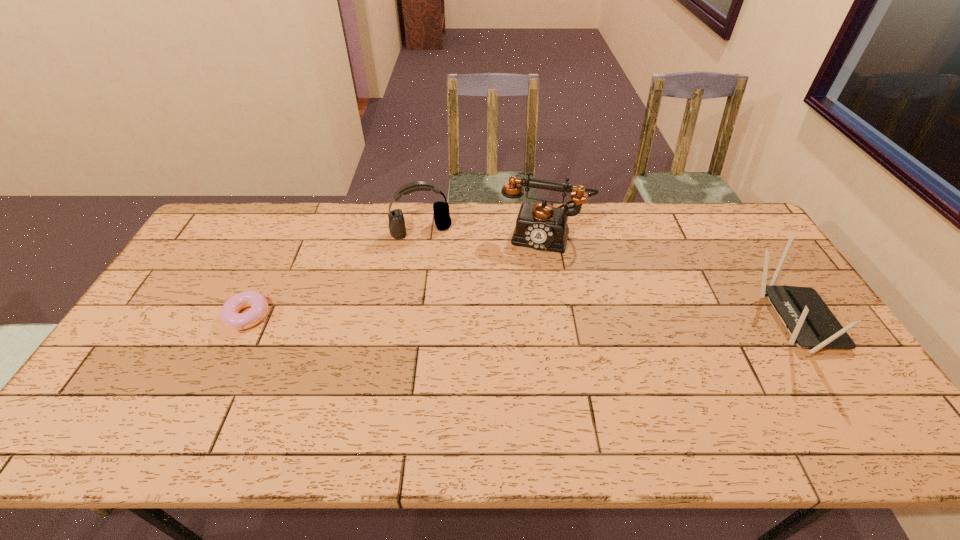
At what (x,y) coordinates should I click in order to perform the action: click on free space located on the headband of the headset. Please return your answer as a coordinate pair (x, y). The width and height of the screenshot is (960, 540). Looking at the image, I should click on (433, 252).

Image resolution: width=960 pixels, height=540 pixels. Find the location of `vacant space located 0.270m on the headband of the headset`. vacant space located 0.270m on the headband of the headset is located at coordinates (448, 296).

Locate an element on the screen. free spot located on the headband of the headset is located at coordinates (434, 255).

Find the location of a particular element. The image size is (960, 540). telephone present at the far edge is located at coordinates tap(540, 226).

Where is `headset located in the far edge section of the desktop`? The image size is (960, 540). headset located in the far edge section of the desktop is located at coordinates (397, 229).

At what (x,y) coordinates should I click in order to perform the action: click on object that is at the right edge. Please return your answer as a coordinate pair (x, y). Looking at the image, I should click on (811, 324).

Where is `free location at the far edge`? free location at the far edge is located at coordinates (484, 228).

The width and height of the screenshot is (960, 540). In order to click on vacant space at the near edge in this screenshot , I will do `click(612, 387)`.

This screenshot has width=960, height=540. Find the location of `vacant point at the left edge`. vacant point at the left edge is located at coordinates (145, 367).

At what (x,y) coordinates should I click in order to perform the action: click on vacant space at the right edge of the desktop. Please return your answer as a coordinate pair (x, y). The width and height of the screenshot is (960, 540). Looking at the image, I should click on (757, 253).